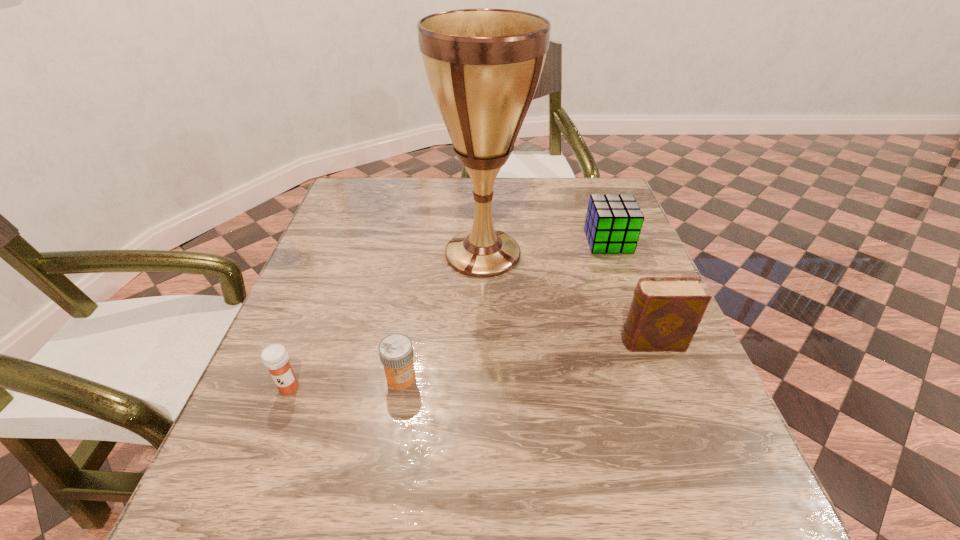
You are a GUI agent. You are given a task and a screenshot of the screen. Output one action in this format:
    pyautogui.click(x=<x>, y=<y>)
    Task: Click on the vacant space that is in between the cube and the right medicine
    The height and width of the screenshot is (540, 960).
    Given the screenshot: What is the action you would take?
    click(505, 309)

The image size is (960, 540). What are the coordinates of `vacant region between the fourth object from right to left and the cube` in the screenshot? It's located at (505, 309).

Locate an element on the screen. This screenshot has height=540, width=960. free space between the third object from left to right and the diary is located at coordinates (567, 298).

Identify which object is the closest to the diary. Please provide its 2D coordinates. Your answer should be formatted as a tuple, i.e. [(x, y)], where the tuple contains the x and y coordinates of a point satisfying the conditions above.

[(483, 65)]

This screenshot has height=540, width=960. What are the coordinates of `object that is the second nearest to the cube` in the screenshot? It's located at (665, 312).

Locate an element on the screen. free space that satisfies the following two spatial constraints: 1. on the back side of the cube; 2. on the left side of the tallest object is located at coordinates (483, 241).

The image size is (960, 540). Identify the location of vacant space that satisfies the following two spatial constraints: 1. on the spine side of the diary; 2. on the label side of the second object from left to right. (665, 377).